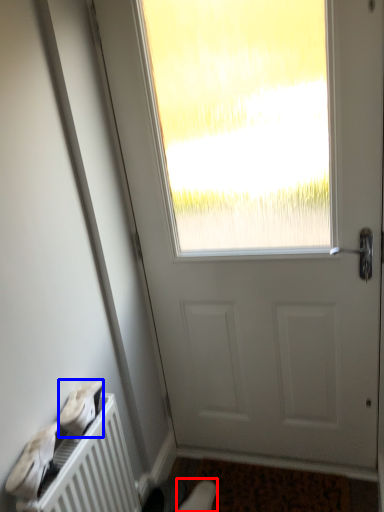
Question: Which object is further to the camera taking this photo, shoe (highlighted by a red box) or shoe (highlighted by a blue box)?

Choices:
 (A) shoe
 (B) shoe

Answer: (A)